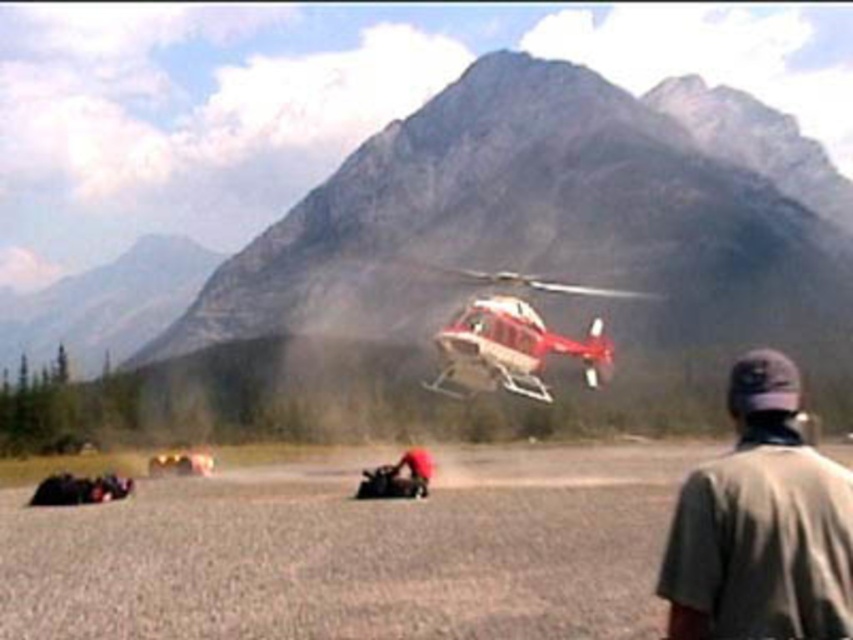
Is rugged stone mountain at upper center below brushed metal mountain at upper left?

No, rugged stone mountain at upper center is not below brushed metal mountain at upper left.

Between rugged stone mountain at upper center and brushed metal mountain at upper left, which one has more height?

rugged stone mountain at upper center

Between point (546, 228) and point (190, 276), which one is positioned in front?

Positioned in front is point (546, 228).

At what (x,y) coordinates should I click in order to perform the action: click on rugged stone mountain at upper center. Please return your answer as a coordinate pair (x, y). Looking at the image, I should click on (531, 220).

Is brown gravel dirt field at center above red matte helicopter at center?

No.

Which is more to the left, brown gravel dirt field at center or red matte helicopter at center?

brown gravel dirt field at center is more to the left.

Is point (248, 470) positioned after point (550, 397)?

Yes, point (248, 470) is farther from viewer.

At what (x,y) coordinates should I click in order to perform the action: click on brown gravel dirt field at center. Please return your answer as a coordinate pair (x, y). Looking at the image, I should click on (355, 552).

Which of these two, rugged stone mountain at upper center or gray fabric cap at upper right, stands taller?

rugged stone mountain at upper center is taller.

Between rugged stone mountain at upper center and gray fabric cap at upper right, which one is positioned lower?

gray fabric cap at upper right

Identify the location of rugged stone mountain at upper center. This screenshot has width=853, height=640. click(531, 220).